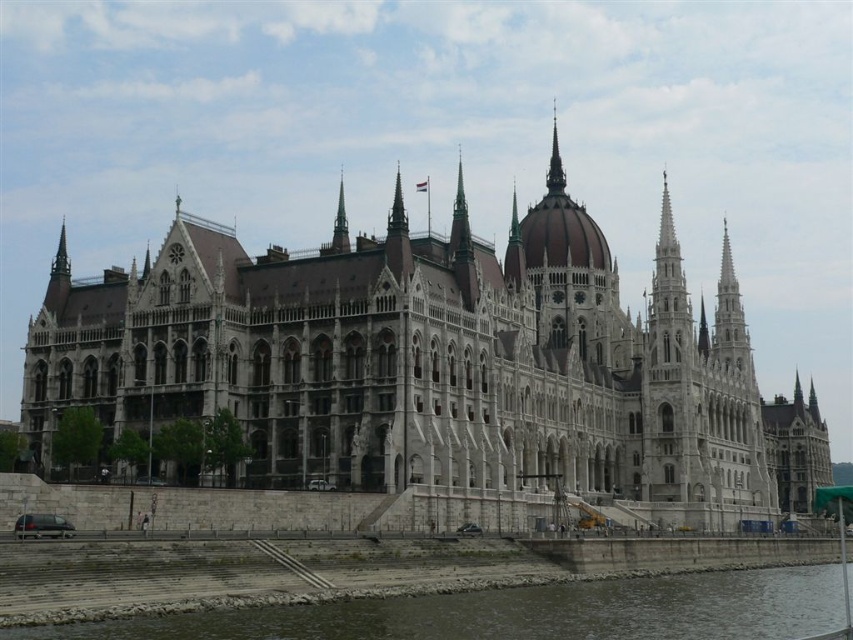
You are a tourist standing in front of the Hungarian Parliament Building. You notice two structures in the scene. One is the white stone palace at center, and the other is the smooth gray spire at center. Which of these two structures is larger in size?

The white stone palace at center is bigger than the smooth gray spire at center.

From the picture: You are an architect visiting the Hungarian Parliament Building. You notice the white stone palace at center and the smooth gray spire at center. Which structure is positioned higher in the image?

The smooth gray spire at center is positioned higher than the white stone palace at center because the white stone palace at center is located below it.

Looking at this image, you are standing at the entrance of the Hungarian Parliament Building and want to take a photo of the gray rocky river at lower left. Where should you position yourself to capture the river in your shot?

To capture the gray rocky river at lower left in your photo, position yourself at the entrance and aim your camera towards the lower left area, specifically targeting the coordinates point at [519,612] where the river is located.